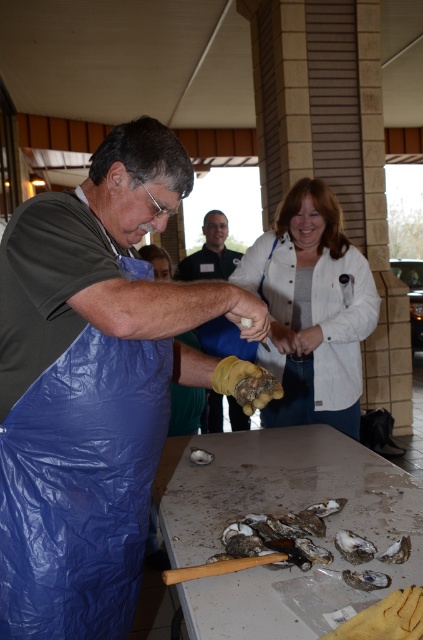
You are standing at the entrance of the indoor porch area. You need to place a new table exactly where the white shell oyster at center is currently located. According to the coordinates provided in the Objects Description, what are the coordinates where you should place the table?

The coordinates for placing the table should be at point (x=280, y=536) as specified in the Objects Description for the white shell oyster at center.

You are standing 2 feet away from the white shell oyster at center. If you want to reach it without moving your feet, can you do it?

The white shell oyster at center is 3.35 feet away from the viewer. Since you are already standing 2 feet away, you are still 1.35 feet away from it. Therefore, you cannot reach it without moving your feet.